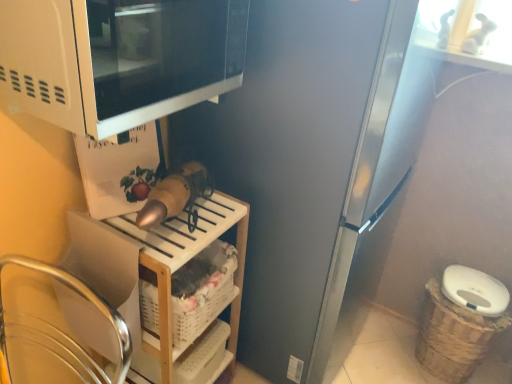
Question: Is satin silver refrigerator at center to the left or to the right of white woven basket at lower center, the first basket in the front-to-back sequence, in the image?

Choices:
 (A) left
 (B) right

Answer: (B)

Question: Is satin silver refrigerator at center bigger or smaller than white woven basket at lower center, placed as the second basket when sorted from back to front?

Choices:
 (A) big
 (B) small

Answer: (A)

Question: Which object is the closest to the satin silver refrigerator at center?

Choices:
 (A) woven brown basket at lower right, which is the second basket from front to back
 (B) white woven basket at lower center, placed as the second basket when sorted from back to front
 (C) white matte microwave at upper left
 (D) white plastic shelf at lower center

Answer: (D)

Question: Estimate the real-world distances between objects in this image. Which object is closer to the white woven basket at lower center, which is counted as the 1th basket, starting from the left?

Choices:
 (A) white plastic shelf at lower center
 (B) woven brown basket at lower right, the second basket from the left
 (C) white matte microwave at upper left
 (D) satin silver refrigerator at center

Answer: (A)